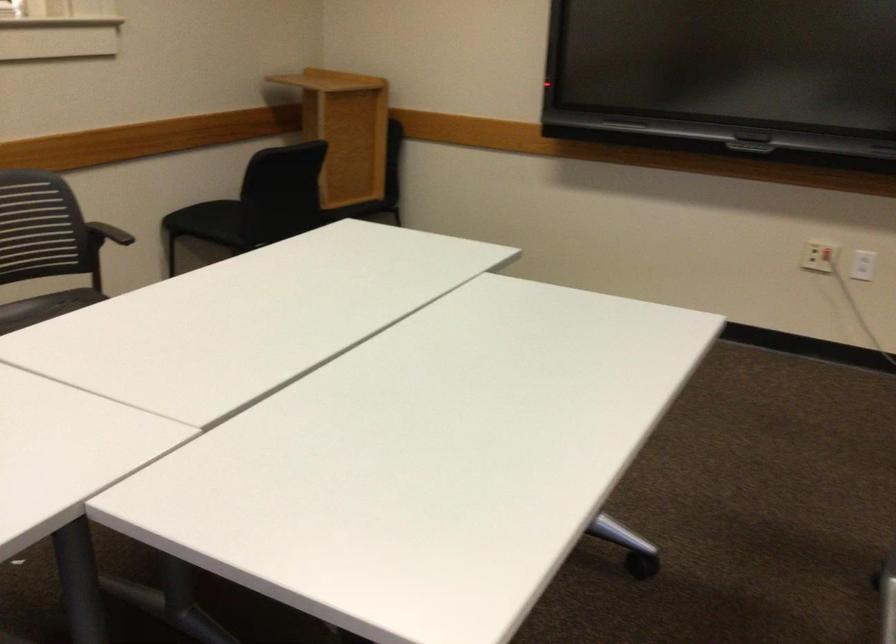
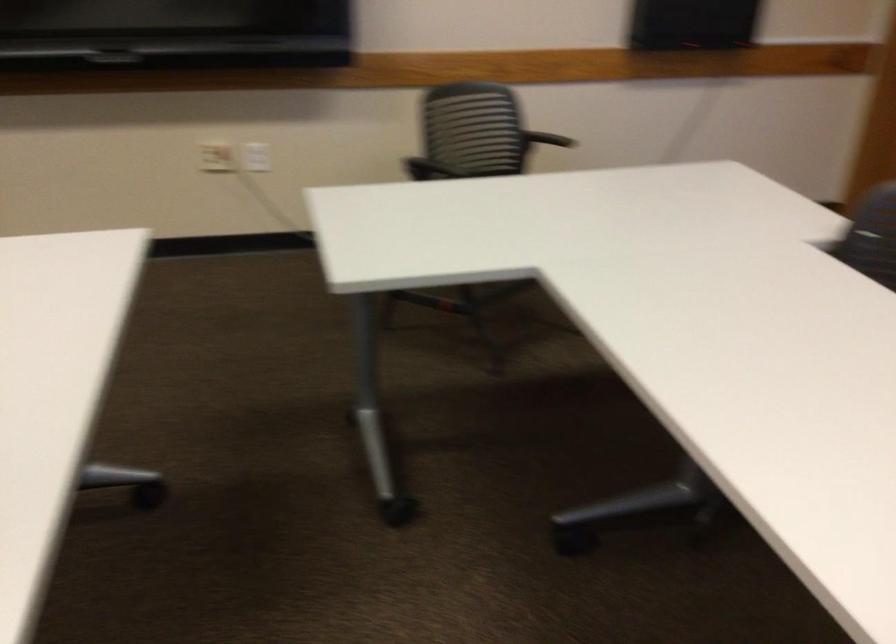
Question: The camera is either moving clockwise (left) or counter-clockwise (right) around the object. The first image is from the beginning of the video and the second image is from the end. Is the camera moving left or right when shooting the video?

Choices:
 (A) Left
 (B) Right

Answer: (A)